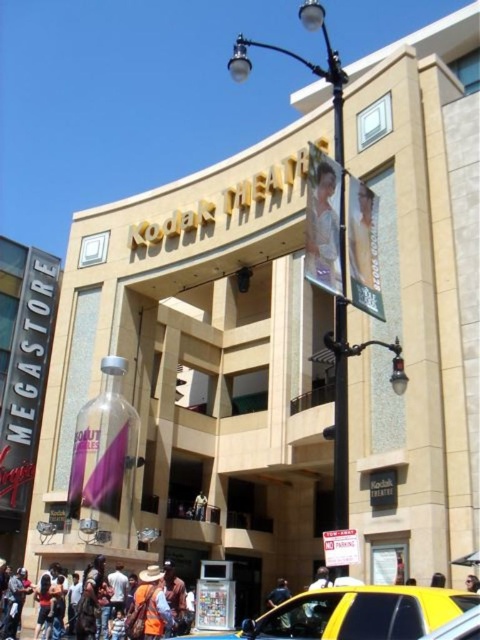
Question: Which object is farther from the camera taking this photo?

Choices:
 (A) dark blue jeans at lower center
 (B) yellow rubber taxi at lower center
 (C) camouflage-patterned shirt at center
 (D) orange safety vest at lower center

Answer: (D)

Question: Which point appears farthest from the camera in this image?

Choices:
 (A) (328, 173)
 (B) (405, 634)

Answer: (A)

Question: Does yellow rubber taxi at lower center have a smaller size compared to white glossy dress at upper center?

Choices:
 (A) yes
 (B) no

Answer: (B)

Question: Based on their relative distances, which object is nearer to the camouflage-patterned shirt at center?

Choices:
 (A) white glossy dress at upper center
 (B) orange safety vest at lower center

Answer: (B)

Question: Can you confirm if orange safety vest at lower center is positioned to the right of dark blue jeans at lower center?

Choices:
 (A) yes
 (B) no

Answer: (B)

Question: From the image, what is the correct spatial relationship of orange safety vest at lower center in relation to camouflage-patterned shirt at center?

Choices:
 (A) right
 (B) left

Answer: (B)